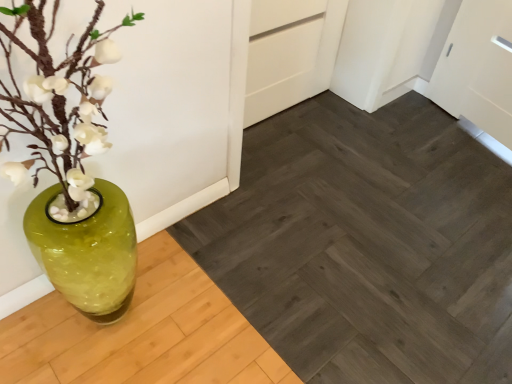
Question: Looking at the image, does dark gray wood plank at center seem bigger or smaller compared to green glass vase at left?

Choices:
 (A) small
 (B) big

Answer: (B)

Question: Is dark gray wood plank at center spatially inside green glass vase at left, or outside of it?

Choices:
 (A) outside
 (B) inside

Answer: (A)

Question: Is dark gray wood plank at center wider or thinner than green glass vase at left?

Choices:
 (A) wide
 (B) thin

Answer: (A)

Question: From the image's perspective, relative to dark gray wood plank at center, is green glass vase at left above or below?

Choices:
 (A) below
 (B) above

Answer: (B)

Question: From a real-world perspective, is green glass vase at left above or below dark gray wood plank at center?

Choices:
 (A) above
 (B) below

Answer: (A)

Question: Would you say green glass vase at left is to the left or to the right of dark gray wood plank at center in the picture?

Choices:
 (A) right
 (B) left

Answer: (B)

Question: Considering the positions of point (51, 157) and point (233, 210), is point (51, 157) closer or farther from the camera than point (233, 210)?

Choices:
 (A) closer
 (B) farther

Answer: (A)